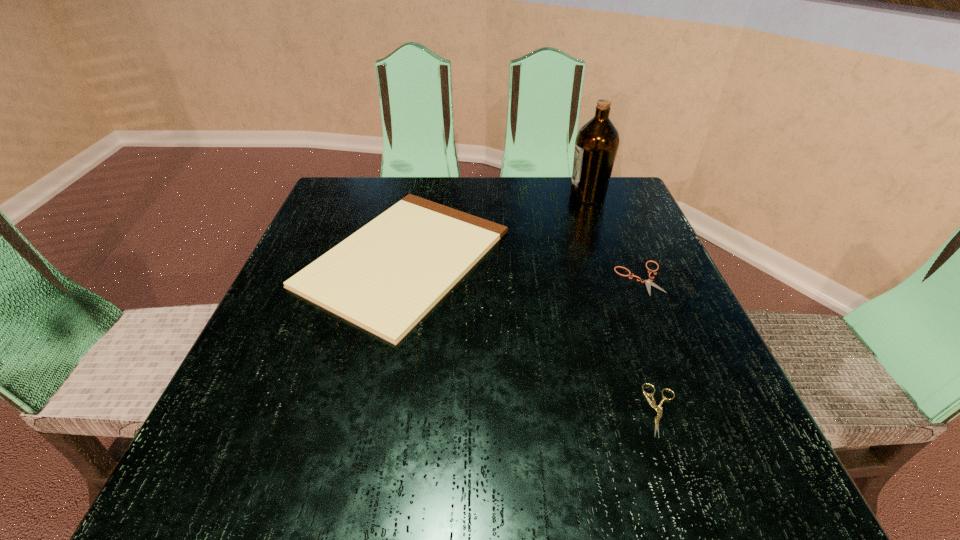
Identify the location of free space located on the back of the farther shears. (598, 177).

The image size is (960, 540). I want to click on olive oil present at the far edge, so click(x=597, y=142).

At what (x,y) coordinates should I click in order to perform the action: click on clipboard located at the far edge. Please return your answer as a coordinate pair (x, y). The height and width of the screenshot is (540, 960). Looking at the image, I should click on (385, 277).

Where is `object that is positioned at the near edge`? The height and width of the screenshot is (540, 960). object that is positioned at the near edge is located at coordinates (652, 403).

You are a GUI agent. You are given a task and a screenshot of the screen. Output one action in this format:
    pyautogui.click(x=<x>, y=<y>)
    Task: Click on the object at the left edge
    The height and width of the screenshot is (540, 960).
    Given the screenshot: What is the action you would take?
    pyautogui.click(x=385, y=277)

Locate an element on the screen. This screenshot has width=960, height=540. olive oil that is at the right edge is located at coordinates (597, 142).

Find the location of a particular element. The image size is (960, 540). object positioned at the far left corner is located at coordinates (385, 277).

Where is `object that is at the far right corner`? object that is at the far right corner is located at coordinates (597, 142).

Identify the location of object that is at the near right corner. (652, 403).

Where is `free space at the far edge of the desktop`? This screenshot has width=960, height=540. free space at the far edge of the desktop is located at coordinates (438, 200).